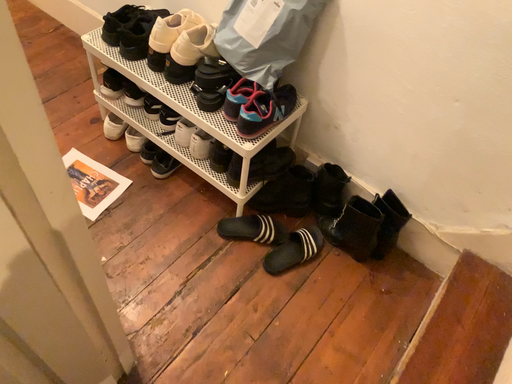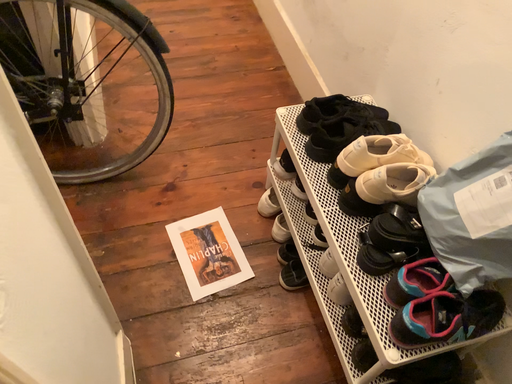
Question: How did the camera likely rotate when shooting the video?

Choices:
 (A) rotated downward
 (B) rotated upward

Answer: (B)